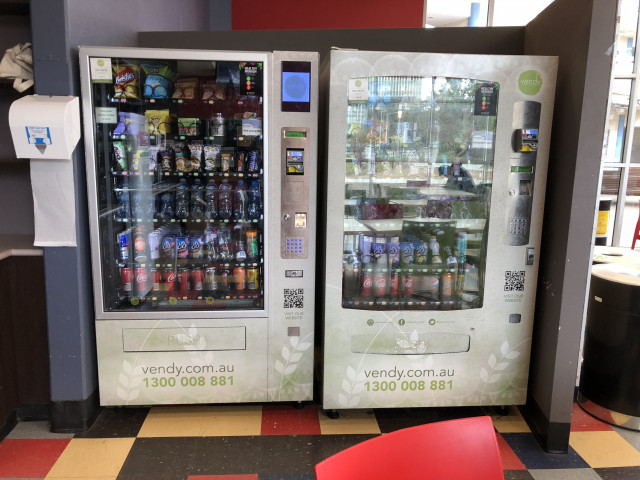
I want to click on vending machine, so click(276, 330), click(348, 358).